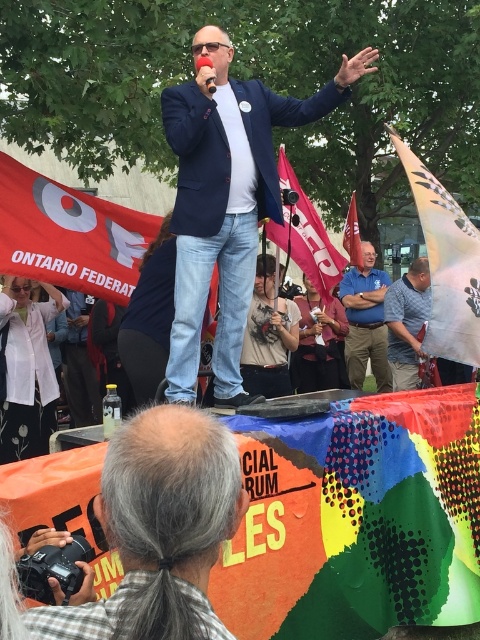
Does point (275, 358) lie behind point (278, 157)?

No, (275, 358) is closer to viewer.

Where is `khaki cotton shirt at center`? khaki cotton shirt at center is located at coordinates (267, 336).

Identify the location of khaki cotton shirt at center. The image size is (480, 640). 267,336.

Is point (11, 202) closer to viewer compared to point (344, 230)?

Yes, point (11, 202) is closer to viewer.

Is point (39, 260) farther from viewer compared to point (355, 205)?

No, (39, 260) is in front of (355, 205).

Where is `red fabric flag at upper left`? red fabric flag at upper left is located at coordinates (69, 234).

Does red fabric flag at upper left appear on the left side of white fabric flag at lower right?

Indeed, red fabric flag at upper left is positioned on the left side of white fabric flag at lower right.

Which is above, red fabric flag at upper left or white fabric flag at lower right?

red fabric flag at upper left is higher up.

Locate an element on the screen. red fabric flag at upper left is located at coordinates (69, 234).